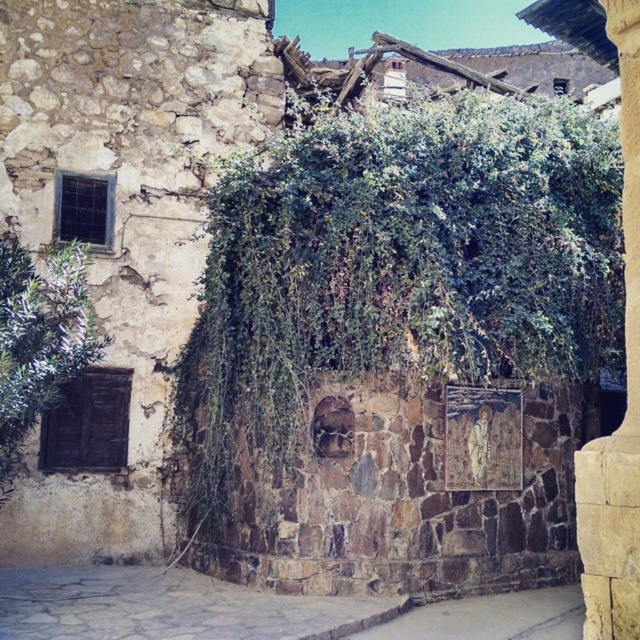
You are a delivery person carrying a large box that is 2 meters wide. You need to pass through either the gray stone alley at lower center or the smooth stone pillar at right. Which path can you take based on their widths?

The gray stone alley at lower center is wider than the smooth stone pillar at right, so the delivery person can take the gray stone alley at lower center since it can accommodate the 2 meter wide box.

You are a painter standing at the base of the rustic stone wall corner. You want to paint the green leafy ivy at center and the gray stone alley at lower center. Which object should you focus on first if you want to paint the narrower one first?

The green leafy ivy at center is thinner than the gray stone alley at lower center, so you should focus on painting the green leafy ivy at center first.